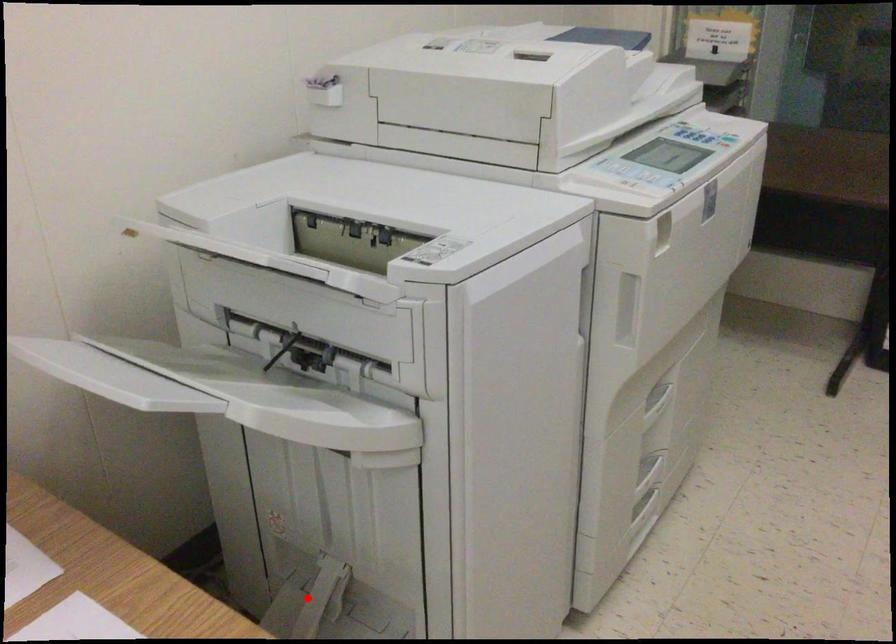
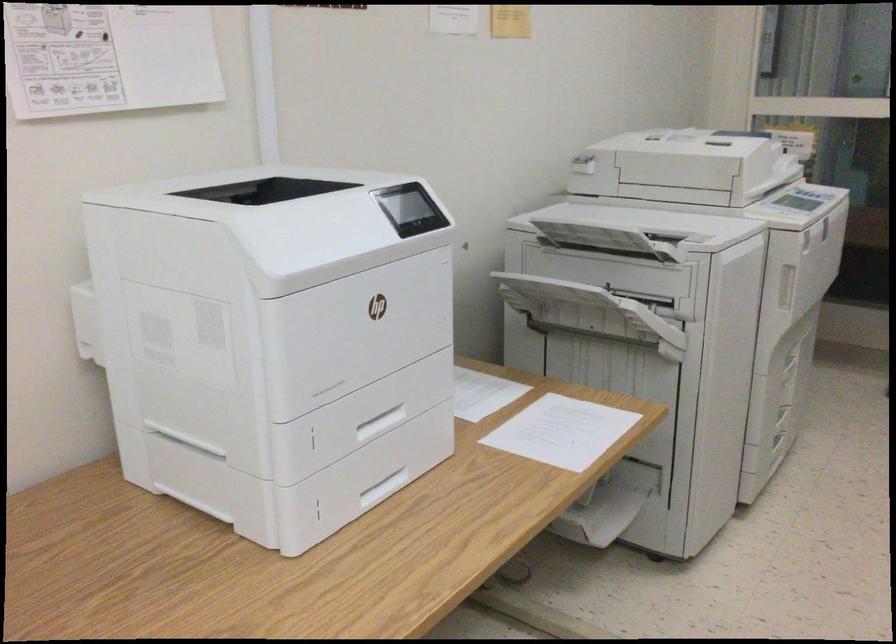
Question: I am providing you with two images of the same scene from different viewpoints. A red point is marked on the first image. Is the red point's position out of view in image 2?

Choices:
 (A) Yes
 (B) No

Answer: (A)